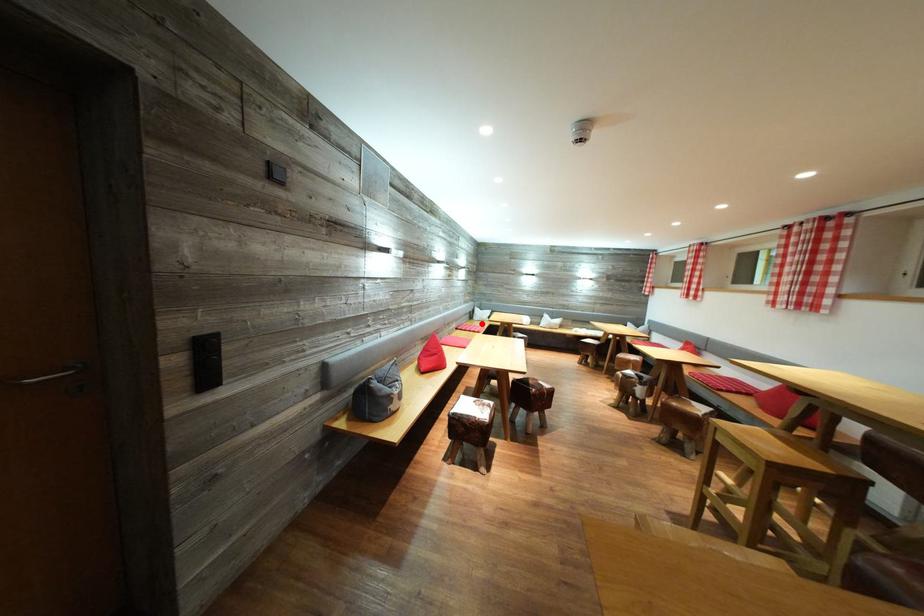
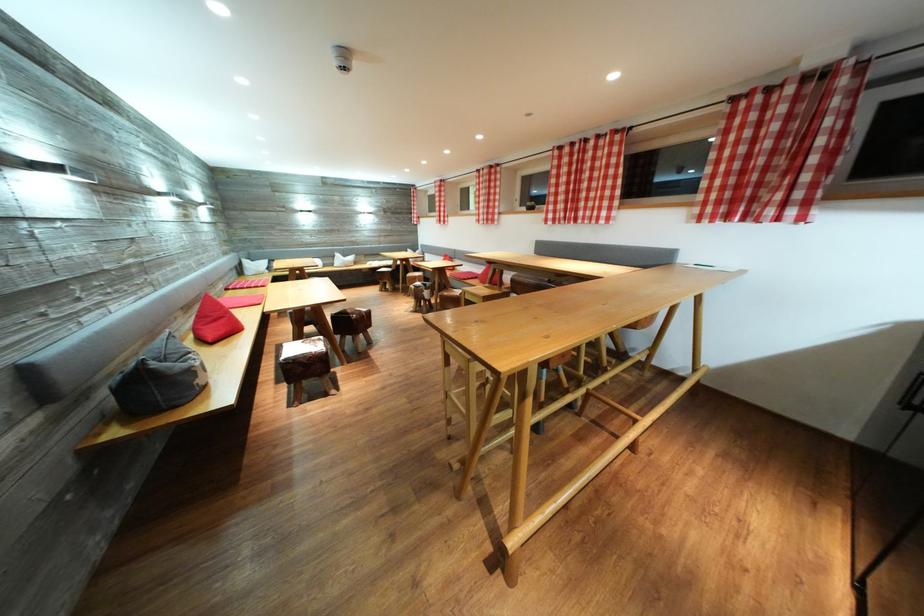
Question: I am providing you with two images of the same scene from different viewpoints. In image1, a red point is highlighted. Considering the same 3D point in image2, which of the following is correct?

Choices:
 (A) It is closer
 (B) It is farther

Answer: (A)